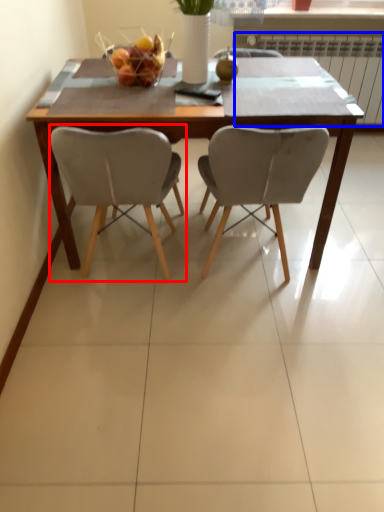
Question: Which point is closer to the camera, chair (highlighted by a red box) or radiator (highlighted by a blue box)?

Choices:
 (A) chair
 (B) radiator

Answer: (A)